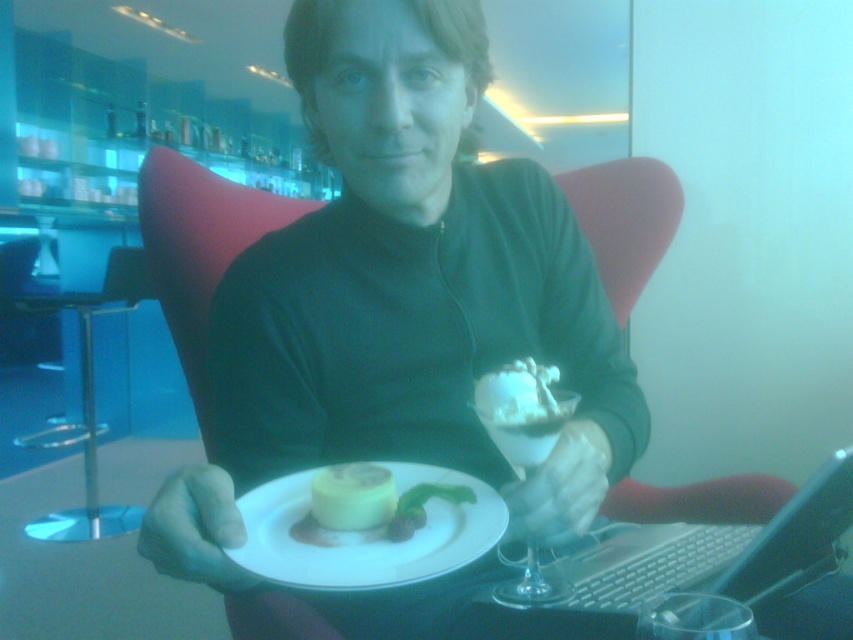
Question: Estimate the real-world distances between objects in this image. Which object is closer to the white creamy cake at center?

Choices:
 (A) white creamy dessert at center
 (B) yellow creamy cake at center

Answer: (B)

Question: Which is farther from the white creamy dessert at center?

Choices:
 (A) transparent plastic table at left
 (B) clear glass dessert cup at center
 (C) white creamy cake at center
 (D) white ceramic plate at center

Answer: (A)

Question: Is white ceramic plate at center wider than white creamy cake at center?

Choices:
 (A) yes
 (B) no

Answer: (A)

Question: Is matte green sweater at center above white creamy dessert at center?

Choices:
 (A) no
 (B) yes

Answer: (A)

Question: Estimate the real-world distances between objects in this image. Which object is farther from the white creamy dessert at center?

Choices:
 (A) clear glass dessert cup at center
 (B) white plastic laptop at lower right

Answer: (B)

Question: Can you confirm if matte green sweater at center is positioned to the left of white creamy cake at center?

Choices:
 (A) no
 (B) yes

Answer: (B)